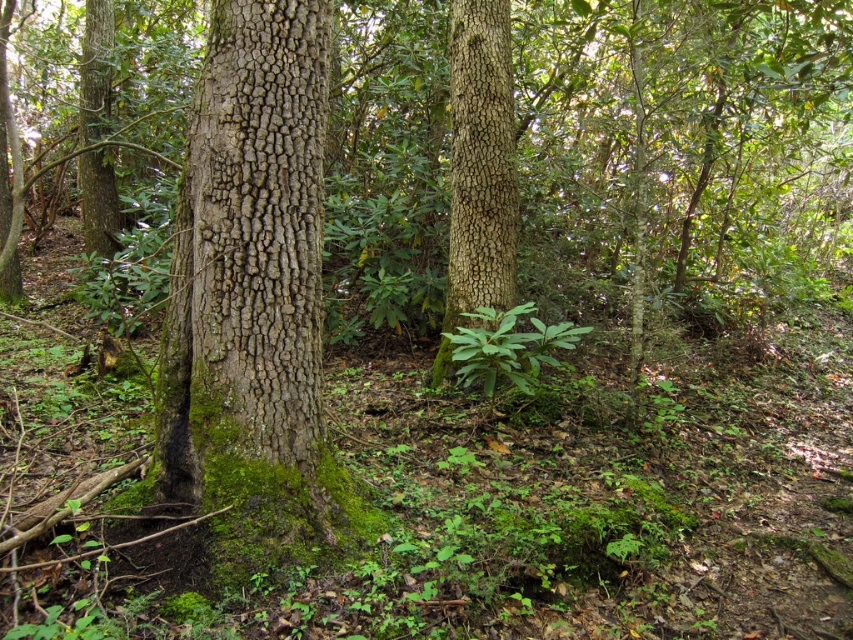
Question: Which of the following is the closest to the observer?

Choices:
 (A) green mossy bark tree trunk at center
 (B) smooth brown bark at center

Answer: (A)

Question: Does green mossy bark tree trunk at center have a lesser width compared to smooth brown bark at center?

Choices:
 (A) yes
 (B) no

Answer: (B)

Question: Is green mossy bark tree trunk at center to the right of smooth brown bark at center from the viewer's perspective?

Choices:
 (A) no
 (B) yes

Answer: (A)

Question: Among these points, which one is nearest to the camera?

Choices:
 (A) (451, 250)
 (B) (236, 8)

Answer: (B)

Question: Does green mossy bark tree trunk at center come in front of smooth brown bark at center?

Choices:
 (A) no
 (B) yes

Answer: (B)